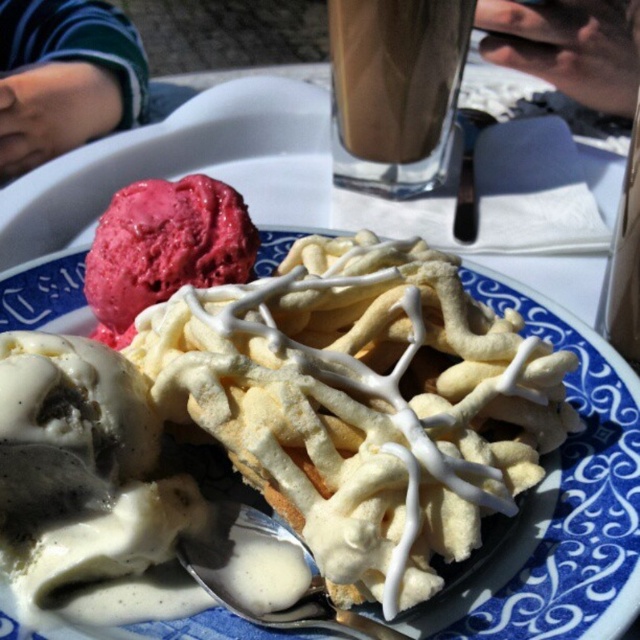
You are a food delivery person who needs to place a drink on the table without spilling it. The drink is 12 inches in diameter. The white glazed waffle at center is on the table. Is there enough space to place the drink next to it?

The distance between the white glazed waffle at center and the edge of the table is not provided, so it is uncertain if there is enough space to place the drink next to it without spilling.

You are a food critic holding a camera 30 inches away from the white glazed waffle at center. Can you capture the entire waffle in your photo without moving the camera?

The white glazed waffle at center is 28.07 inches away from the viewer. Since your camera is 30 inches away, it is within range to capture the entire waffle without needing to move closer.

You are a customer at a dessert bar and want to take a photo of the white glazed waffle at center and the translucent glass cup at upper center. Which one should you focus on first to ensure both are in focus?

You should focus on the white glazed waffle at center first because it is closer to the viewer than the translucent glass cup at upper center, so adjusting focus starting from the closer object ensures both can be in focus.